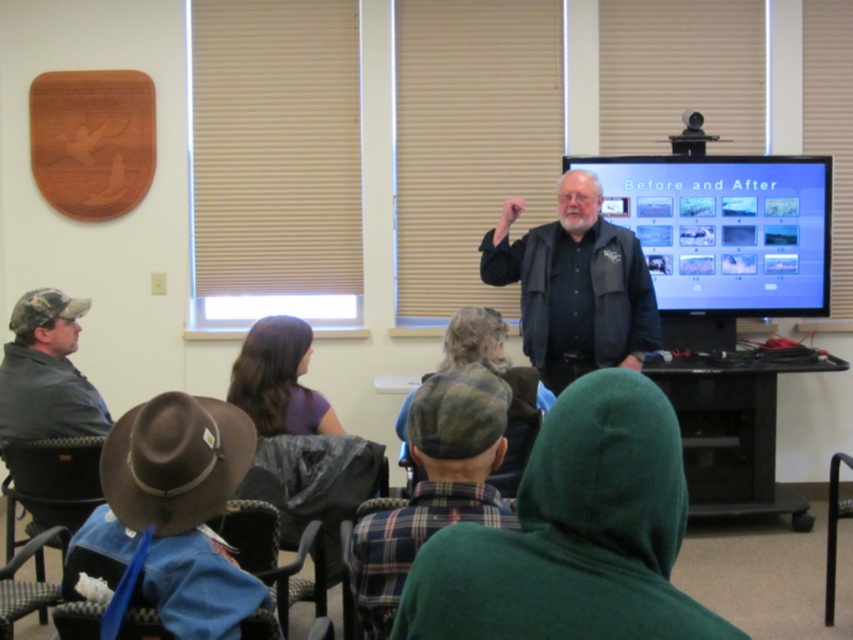
Is black leather jacket at center further to camera compared to camo fabric shirt at left?

Yes, it is.

Is point (605, 236) more distant than point (39, 394)?

Yes, it is behind point (39, 394).

You are a GUI agent. You are given a task and a screenshot of the screen. Output one action in this format:
    pyautogui.click(x=<x>, y=<y>)
    Task: Click on the black leather jacket at center
    
    Given the screenshot: What is the action you would take?
    pyautogui.click(x=575, y=285)

Between plaid fabric shirt at center and brown leather cowboy hat at lower left, which one has more height?

plaid fabric shirt at center

Locate an element on the screen. The width and height of the screenshot is (853, 640). plaid fabric shirt at center is located at coordinates (433, 484).

This screenshot has height=640, width=853. Find the location of `plaid fabric shirt at center`. plaid fabric shirt at center is located at coordinates (433, 484).

Who is more forward, (685,262) or (62,323)?

Point (62,323)

Is point (666, 298) positioned behind point (36, 371)?

Yes, point (666, 298) is farther from viewer.

Where is `matte black screen at center`? matte black screen at center is located at coordinates (724, 228).